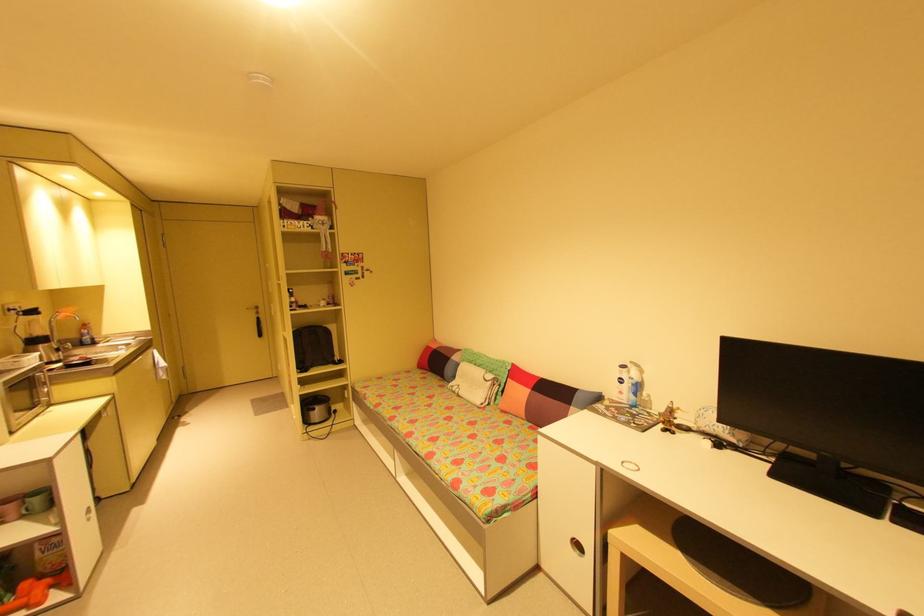
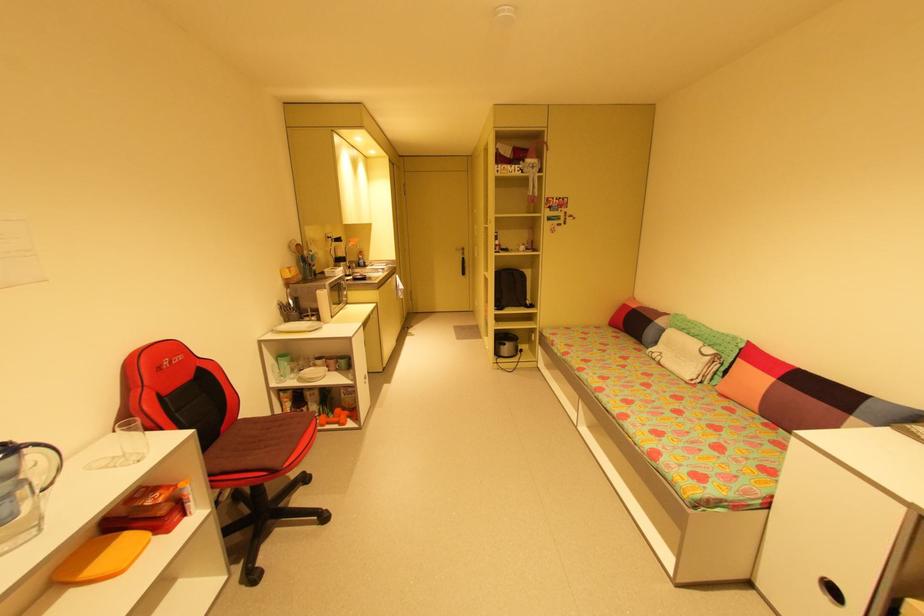
Locate, in the second image, the point that corresponds to pixel 432 462 in the first image.

(625, 422)